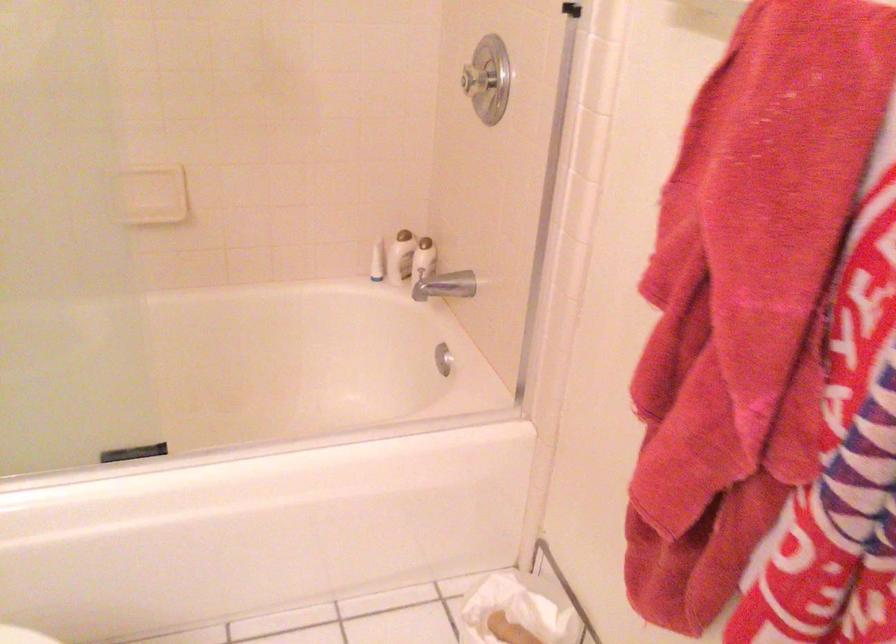
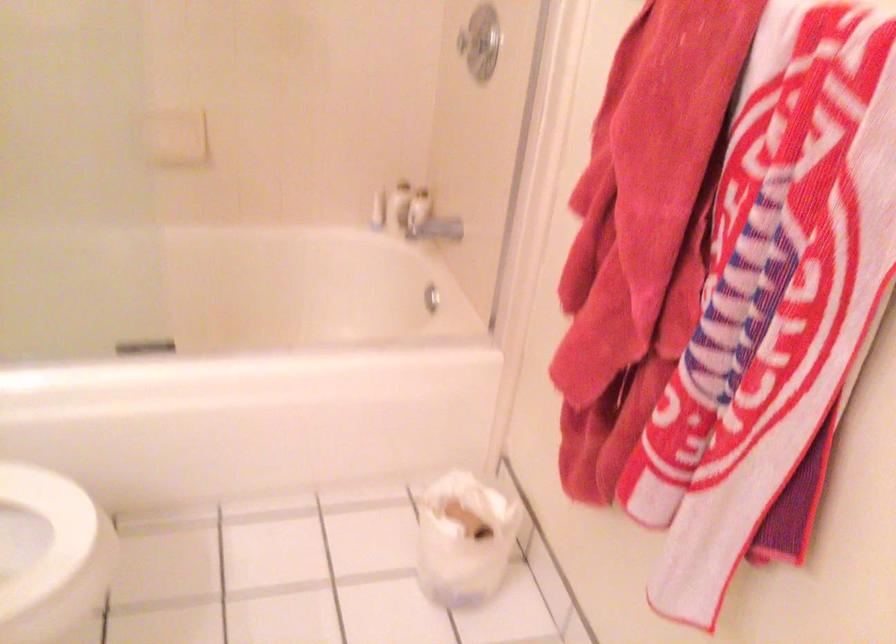
The point at (398, 261) is marked in the first image. Where is the corresponding point in the second image?

(399, 205)